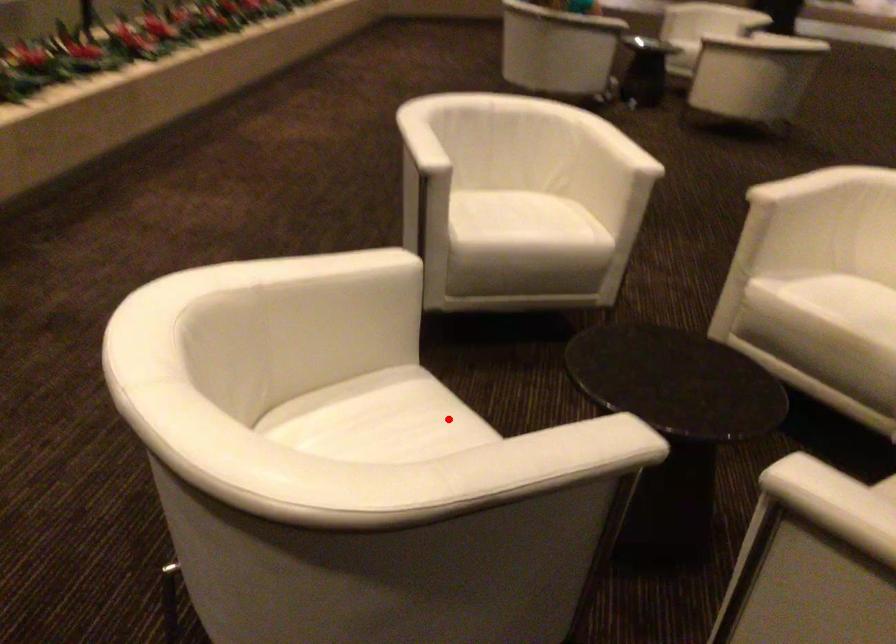
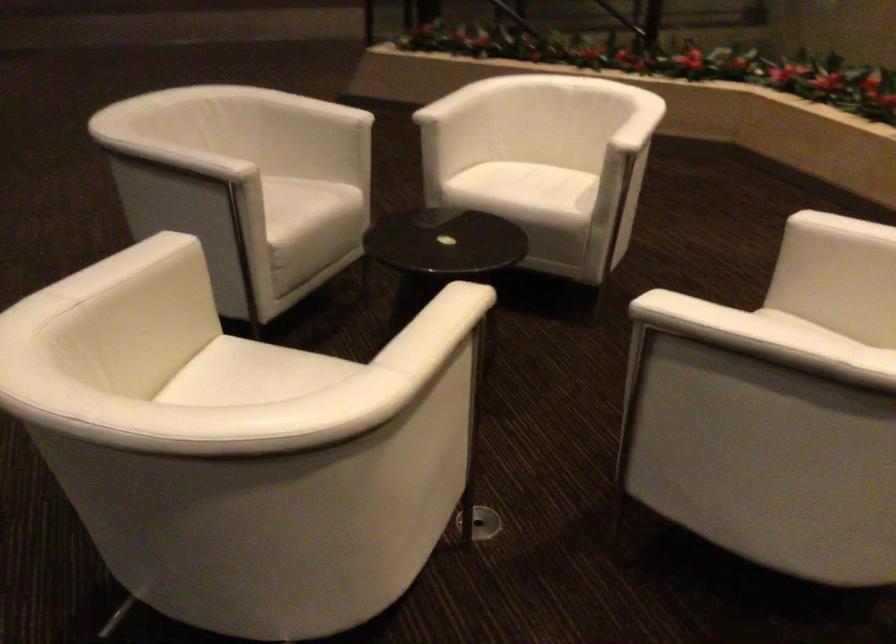
Question: I am providing you with two images of the same scene from different viewpoints. In image1, a red point is highlighted. Considering the same 3D point in image2, which of the following is correct?

Choices:
 (A) It is closer
 (B) It is farther

Answer: (B)